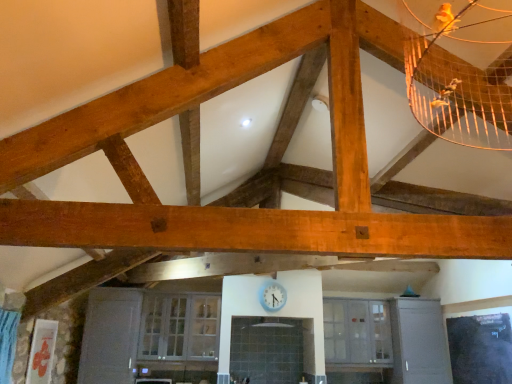
Question: Considering the positions of blue glossy clock at center and clear glass cabinet at center, which ranks as the first window in right-to-left order, in the image, is blue glossy clock at center taller or shorter than clear glass cabinet at center, which ranks as the first window in right-to-left order,?

Choices:
 (A) short
 (B) tall

Answer: (A)

Question: Is blue glossy clock at center to the left or to the right of clear glass cabinet at center, which ranks as the first window in right-to-left order, in the image?

Choices:
 (A) left
 (B) right

Answer: (A)

Question: Based on their relative distances, which object is farther from the clear glass cabinet at lower center, which is the first window in left-to-right order?

Choices:
 (A) blue glossy clock at center
 (B) clear glass cabinet at center, which ranks as the first window in right-to-left order

Answer: (B)

Question: Based on their relative distances, which object is nearer to the clear glass cabinet at center, marked as the second window in a left-to-right arrangement?

Choices:
 (A) clear glass cabinet at lower center, which is the first window in left-to-right order
 (B) blue glossy clock at center

Answer: (B)